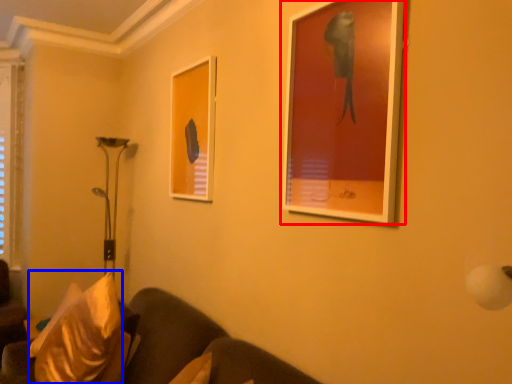
Question: Which object is further to the camera taking this photo, picture frame (highlighted by a red box) or pillow (highlighted by a blue box)?

Choices:
 (A) picture frame
 (B) pillow

Answer: (B)